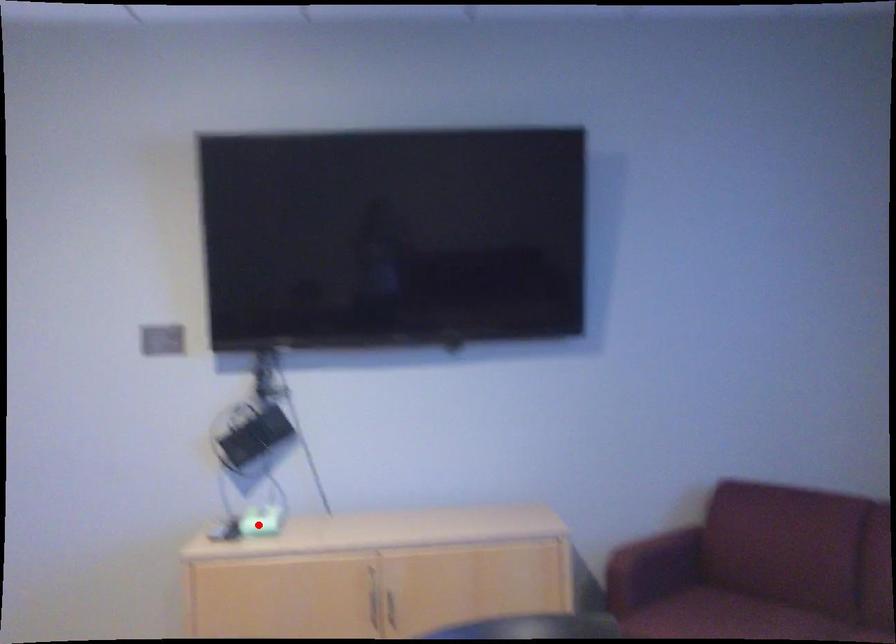
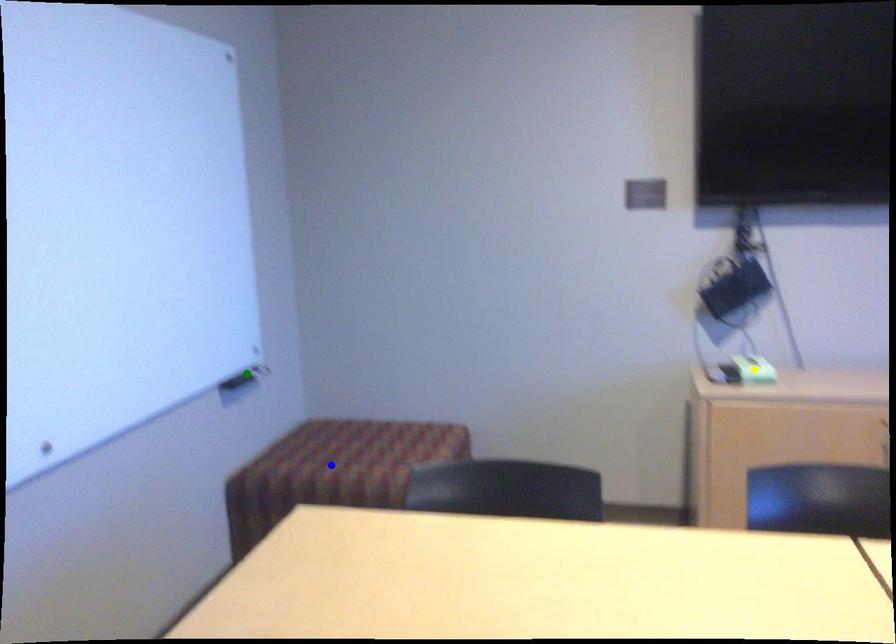
Question: I am providing you with two images of the same scene from different viewpoints. A red point is marked on the first image. You are given multiple points on the second image. Can you choose the point in image 2 that corresponds to the point in image 1?

Choices:
 (A) blue point
 (B) yellow point
 (C) green point

Answer: (B)